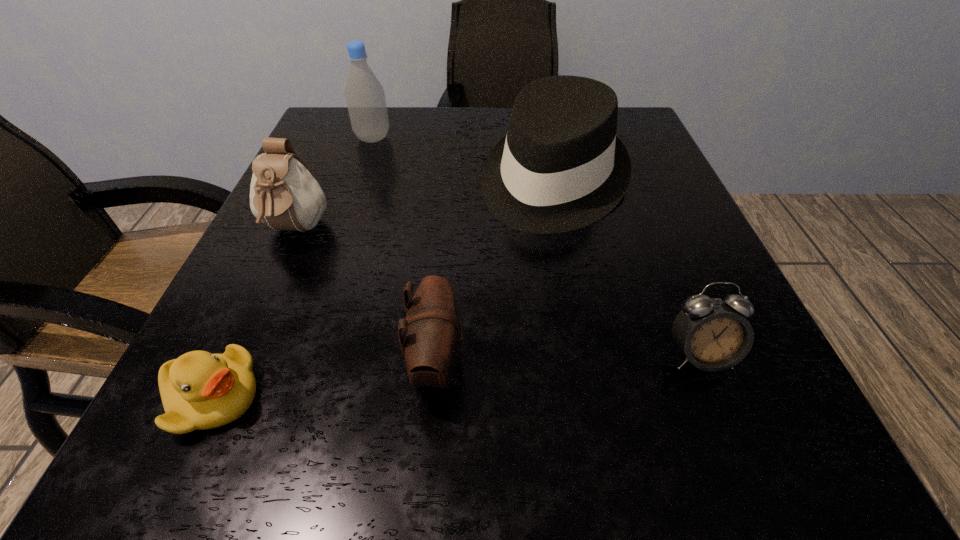
Where is `fedora that is at the right edge`? fedora that is at the right edge is located at coordinates pyautogui.click(x=561, y=167).

Identify the location of alarm clock that is at the right edge. (713, 336).

Where is `object that is positioned at the far left corner`? Image resolution: width=960 pixels, height=540 pixels. object that is positioned at the far left corner is located at coordinates (365, 97).

This screenshot has width=960, height=540. I want to click on object located in the near left corner section of the desktop, so click(x=199, y=390).

Find the location of `object located in the far right corner section of the desktop`. object located in the far right corner section of the desktop is located at coordinates (561, 167).

Identify the location of vacant space at the far edge of the desktop. (471, 127).

This screenshot has height=540, width=960. I want to click on vacant space at the near edge, so click(492, 414).

Find the location of `blank area at the left edge`. blank area at the left edge is located at coordinates (259, 271).

Identify the location of free space at the right edge. The width and height of the screenshot is (960, 540). (670, 326).

Locate an element on the screen. This screenshot has height=540, width=960. vacant position at the far left corner of the desktop is located at coordinates tap(374, 147).